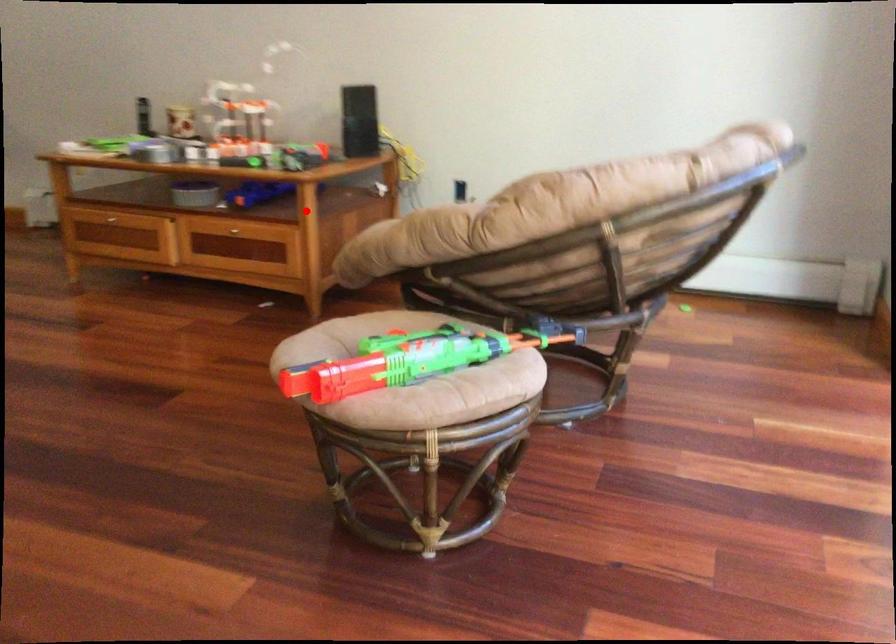
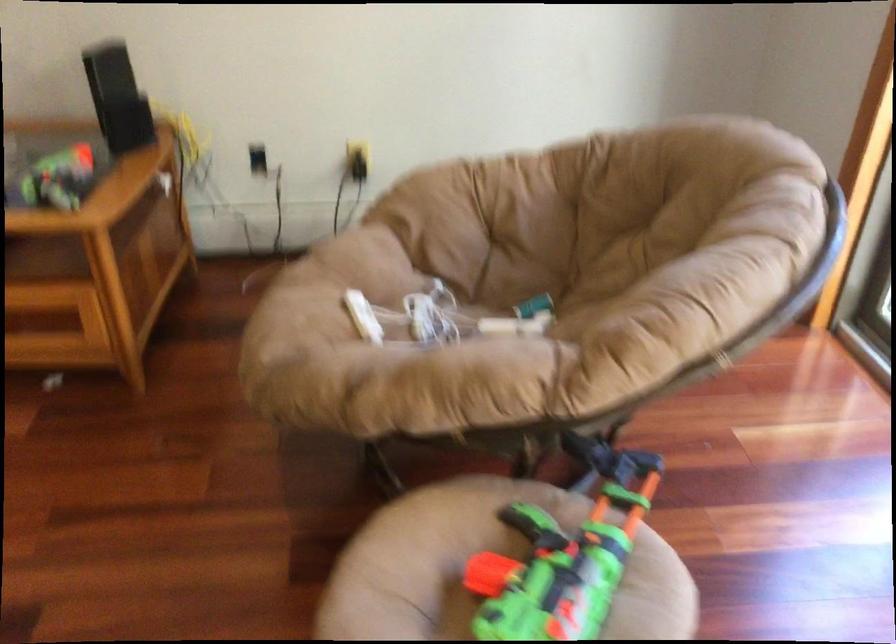
Question: I am providing you with two images of the same scene from different viewpoints. In image1, a red point is highlighted. Considering the same 3D point in image2, which of the following is correct?

Choices:
 (A) It is closer
 (B) It is farther

Answer: (A)